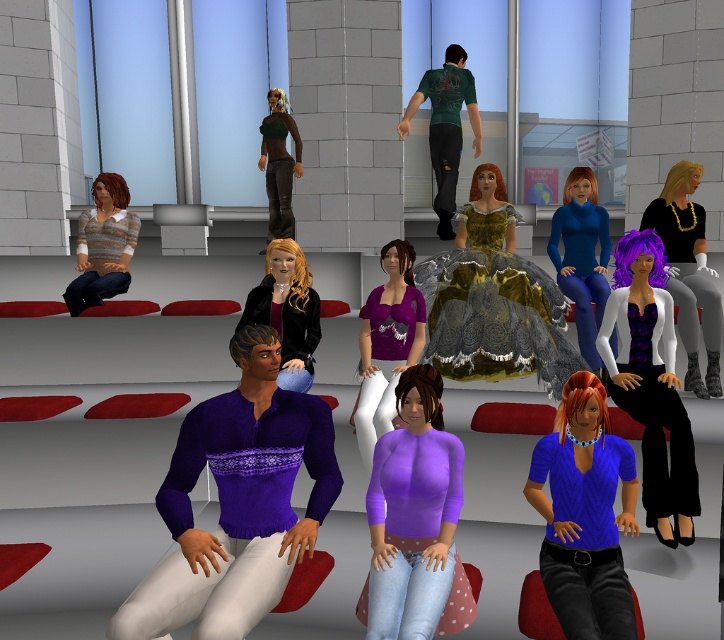
You are a character in the room and want to know which clothing item is closer to the floor between the purple knitted sweater at center and the white matte vest at center. Based on their positions, which one is lower?

The purple knitted sweater at center is below the white matte vest at center, so it is closer to the floor.